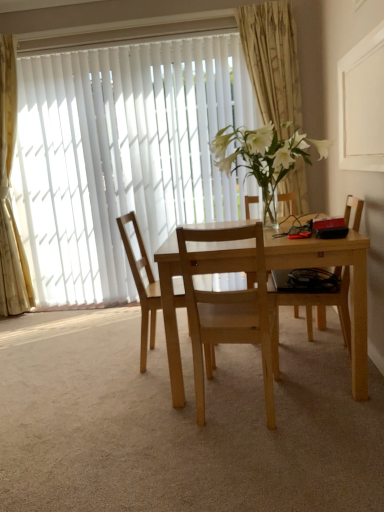
Question: Is light wood table at center in contact with gold textured curtain at upper center, marked as the first curtain in a right-to-left arrangement?

Choices:
 (A) no
 (B) yes

Answer: (A)

Question: Is light wood table at center outside gold textured curtain at upper center, marked as the first curtain in a right-to-left arrangement?

Choices:
 (A) no
 (B) yes

Answer: (B)

Question: Does light wood table at center appear on the left side of gold textured curtain at upper center, marked as the first curtain in a right-to-left arrangement?

Choices:
 (A) yes
 (B) no

Answer: (A)

Question: Can gold textured curtain at upper center, marked as the 2th curtain in a left-to-right arrangement, be found inside light wood table at center?

Choices:
 (A) no
 (B) yes

Answer: (A)

Question: Is light wood table at center further to camera compared to gold textured curtain at upper center, marked as the 2th curtain in a left-to-right arrangement?

Choices:
 (A) yes
 (B) no

Answer: (B)

Question: From the image's perspective, would you say light wood table at center is positioned over gold textured curtain at upper center, marked as the first curtain in a right-to-left arrangement?

Choices:
 (A) no
 (B) yes

Answer: (A)

Question: From a real-world perspective, is white vertical blinds at upper left positioned over gold textured curtain at upper center, marked as the first curtain in a right-to-left arrangement, based on gravity?

Choices:
 (A) yes
 (B) no

Answer: (B)

Question: Is white vertical blinds at upper left further to the viewer compared to gold textured curtain at upper center, marked as the 2th curtain in a left-to-right arrangement?

Choices:
 (A) yes
 (B) no

Answer: (A)

Question: Is white vertical blinds at upper left at the right side of gold textured curtain at upper center, marked as the 2th curtain in a left-to-right arrangement?

Choices:
 (A) yes
 (B) no

Answer: (B)

Question: Is white vertical blinds at upper left positioned in front of gold textured curtain at upper center, marked as the 2th curtain in a left-to-right arrangement?

Choices:
 (A) no
 (B) yes

Answer: (A)

Question: Can you confirm if white vertical blinds at upper left is wider than gold textured curtain at upper center, marked as the first curtain in a right-to-left arrangement?

Choices:
 (A) yes
 (B) no

Answer: (B)

Question: Is white vertical blinds at upper left not near gold textured curtain at upper center, marked as the first curtain in a right-to-left arrangement?

Choices:
 (A) no
 (B) yes

Answer: (A)

Question: Considering the relative sizes of gold textured curtain at upper center, marked as the 2th curtain in a left-to-right arrangement, and white vertical blinds at upper left in the image provided, is gold textured curtain at upper center, marked as the 2th curtain in a left-to-right arrangement, smaller than white vertical blinds at upper left?

Choices:
 (A) yes
 (B) no

Answer: (A)